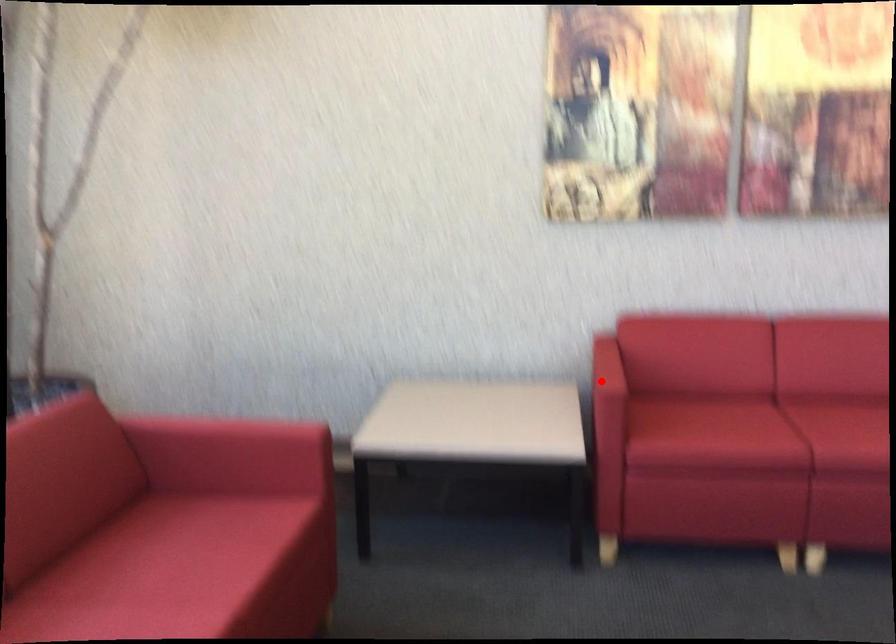
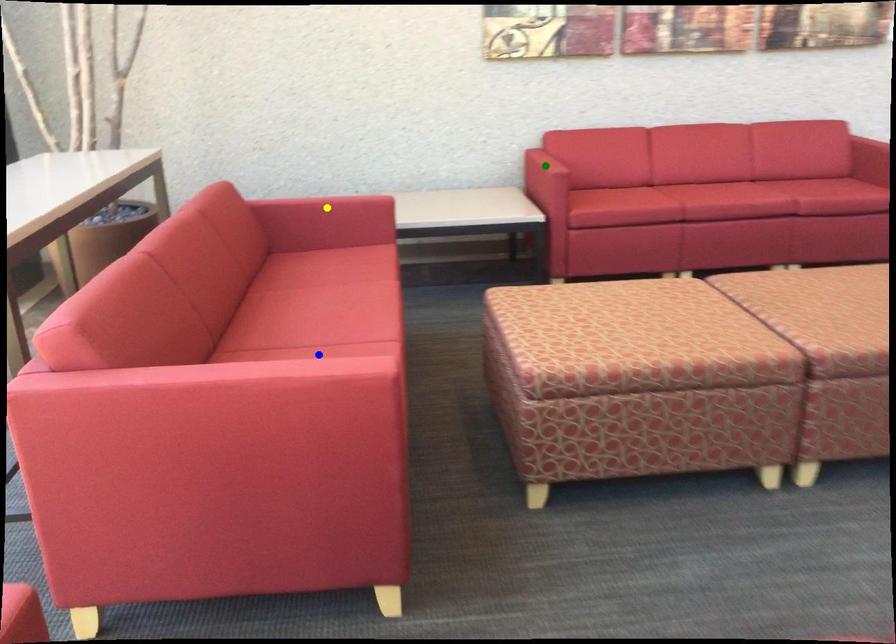
Question: I am providing you with two images of the same scene from different viewpoints. A red point is marked on the first image. You are given multiple points on the second image. Which spot in image 2 lines up with the point in image 1?

Choices:
 (A) green point
 (B) yellow point
 (C) blue point

Answer: (A)